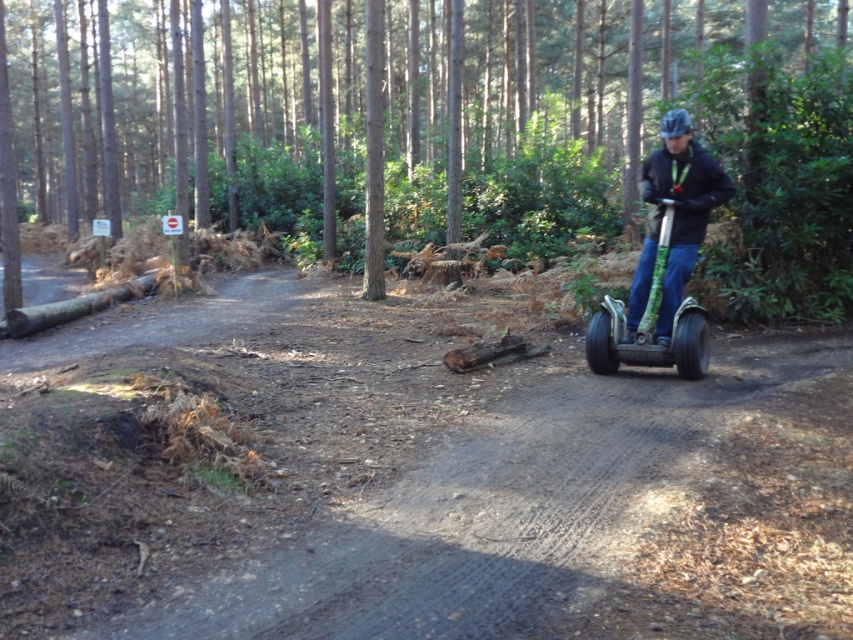
Question: Which point is farther to the camera?

Choices:
 (A) (445, 144)
 (B) (643, 301)

Answer: (A)

Question: Does green textured log at center appear on the left side of green textured scooter at right?

Choices:
 (A) no
 (B) yes

Answer: (B)

Question: Which of these objects is positioned farthest from the green textured segway at right?

Choices:
 (A) green textured scooter at right
 (B) green textured log at center
 (C) brown dirt track at center

Answer: (B)

Question: Can you confirm if brown dirt track at center is thinner than green textured log at center?

Choices:
 (A) no
 (B) yes

Answer: (B)

Question: Can you confirm if brown dirt track at center is positioned to the right of green textured log at center?

Choices:
 (A) yes
 (B) no

Answer: (B)

Question: Which of the following is the farthest from the observer?

Choices:
 (A) (701, 316)
 (B) (689, 156)
 (C) (325, 582)

Answer: (A)